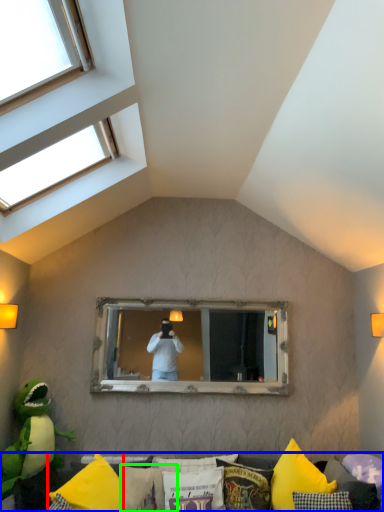
Question: Considering the real-world distances, which object is farthest from pillow (highlighted by a red box)? furniture (highlighted by a blue box) or pillow (highlighted by a green box)?

Choices:
 (A) furniture
 (B) pillow

Answer: (A)